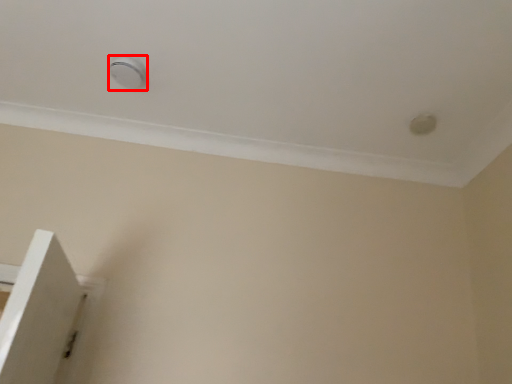
Question: From the image's perspective, considering the relative positions of knob (annotated by the red box) and knob in the image provided, where is knob (annotated by the red box) located with respect to the staircase?

Choices:
 (A) above
 (B) below

Answer: (A)